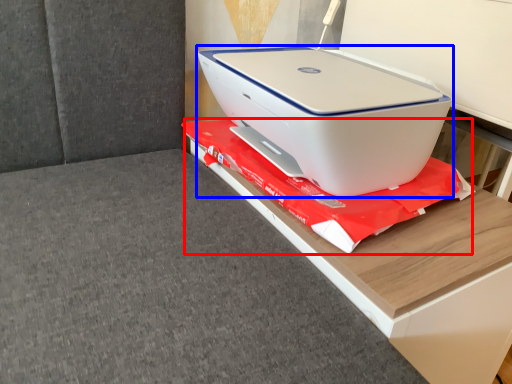
Question: Among these objects, which one is farthest to the camera, material (highlighted by a red box) or printer (highlighted by a blue box)?

Choices:
 (A) material
 (B) printer

Answer: (A)